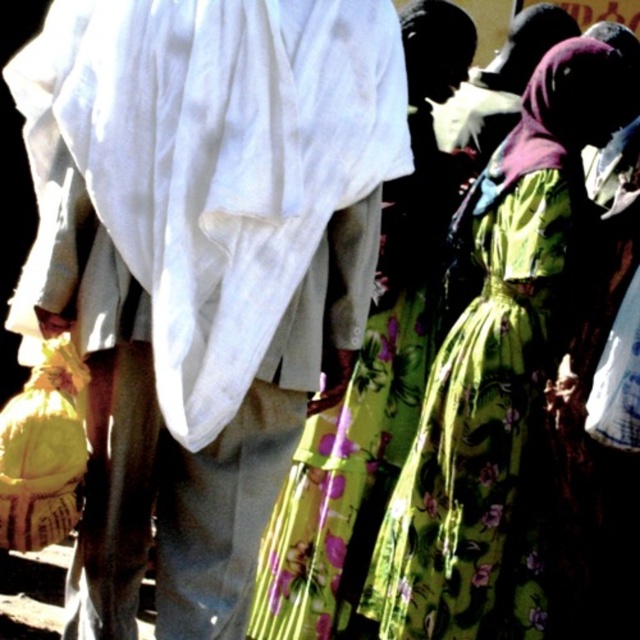
Question: Can you confirm if floral green dress at center is positioned to the right of floral fabric dress at center?

Choices:
 (A) yes
 (B) no

Answer: (A)

Question: Considering the relative positions of floral green dress at center and floral fabric dress at center in the image provided, where is floral green dress at center located with respect to floral fabric dress at center?

Choices:
 (A) above
 (B) below

Answer: (B)

Question: Which point is farther from the camera taking this photo?

Choices:
 (A) (189, 42)
 (B) (422, 285)

Answer: (B)

Question: Considering the real-world distances, which object is closest to the floral fabric dress at center?

Choices:
 (A) white cotton cloth at center
 (B) floral green dress at center

Answer: (B)

Question: Which point is farther from the camera taking this photo?

Choices:
 (A) (500, 212)
 (B) (157, 128)
 (C) (291, 477)

Answer: (C)

Question: Is white cotton cloth at center bigger than floral green dress at center?

Choices:
 (A) no
 (B) yes

Answer: (B)